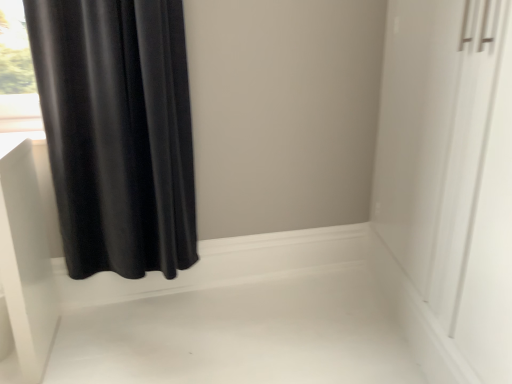
What do you see at coordinates (117, 132) in the screenshot?
I see `velvet black curtain at left` at bounding box center [117, 132].

In order to face velvet black curtain at left, should I rotate leftwards or rightwards?

Rotate your view left by about 17.794°.

Identify the location of velvet black curtain at left. This screenshot has width=512, height=384. (117, 132).

This screenshot has height=384, width=512. Identify the location of velvet black curtain at left. (117, 132).